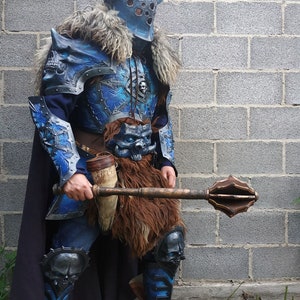
Locate an element on the screen. The width and height of the screenshot is (300, 300). brick wall is located at coordinates (222, 104).